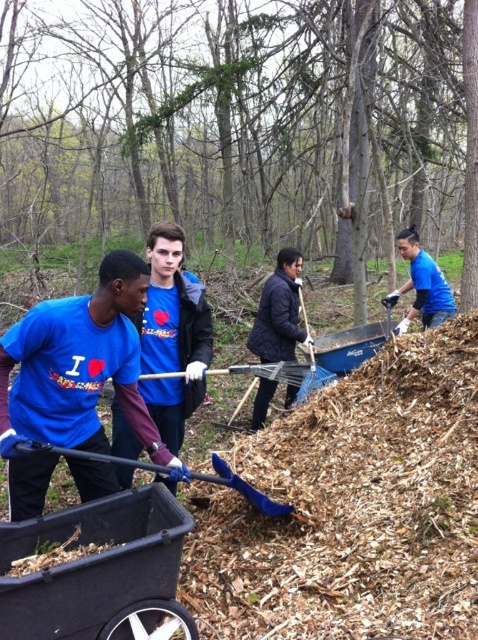
You are a worker in the woods and need to pick up the blue plastic shovel at lower center. You are currently standing next to the blue matte shirt at center. Can you reach the shovel without moving your feet?

The blue matte shirt at center and blue plastic shovel at lower center are 12.90 inches apart. Since 12.90 inches is less than the typical arm reach, you can likely reach the shovel without moving your feet.

You are a photographer trying to capture a photo of the blue plastic shovel at lower center without including the blue matte shirt at upper right in the frame. Based on their positions, is this possible?

The blue matte shirt at upper right is to the right of the blue plastic shovel at lower center, so if you position yourself to the left side of the shovel, you can frame the shovel while excluding the shirt.